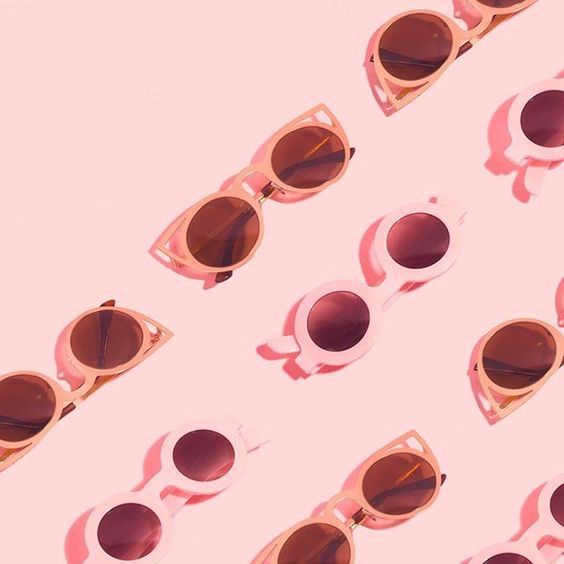
Locate an element on the screen. right-side up glasses is located at coordinates (252, 169), (338, 494), (152, 486), (533, 532), (549, 85).